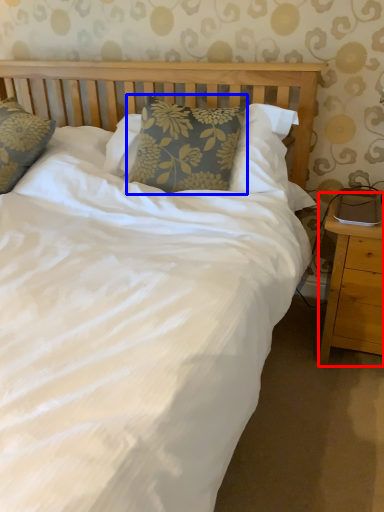
Question: Which object appears farthest to the camera in this image, nightstand (highlighted by a red box) or pillow (highlighted by a blue box)?

Choices:
 (A) nightstand
 (B) pillow

Answer: (B)